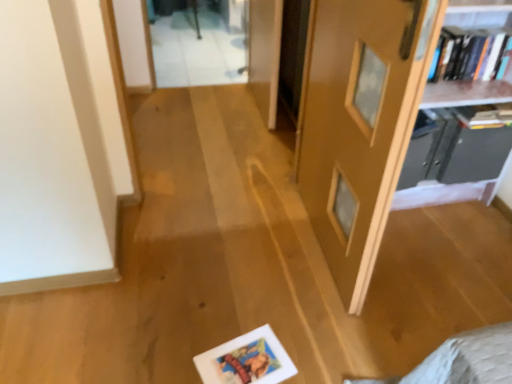
Image resolution: width=512 pixels, height=384 pixels. Identify the location of free point below matte wooden door at center (from a real-world perspective). (310, 235).